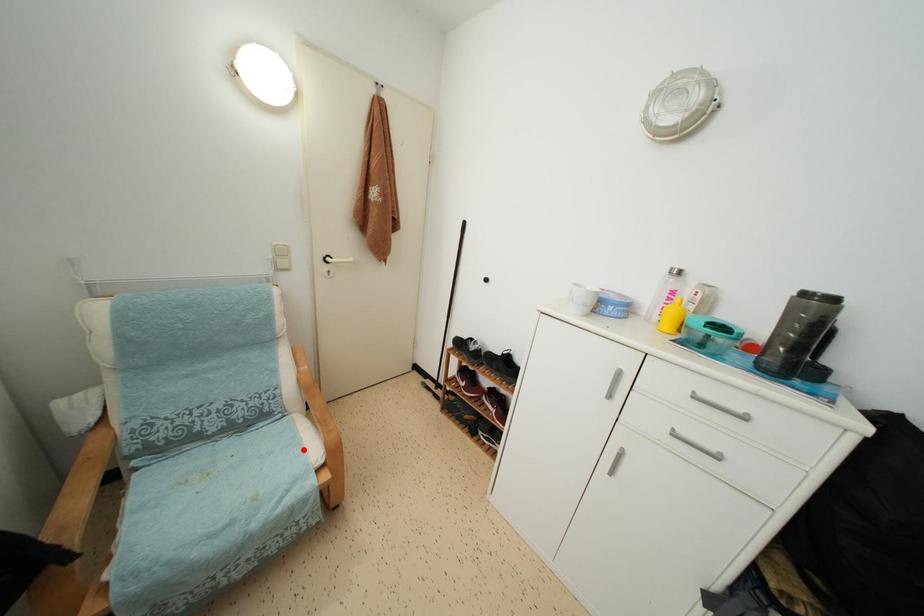
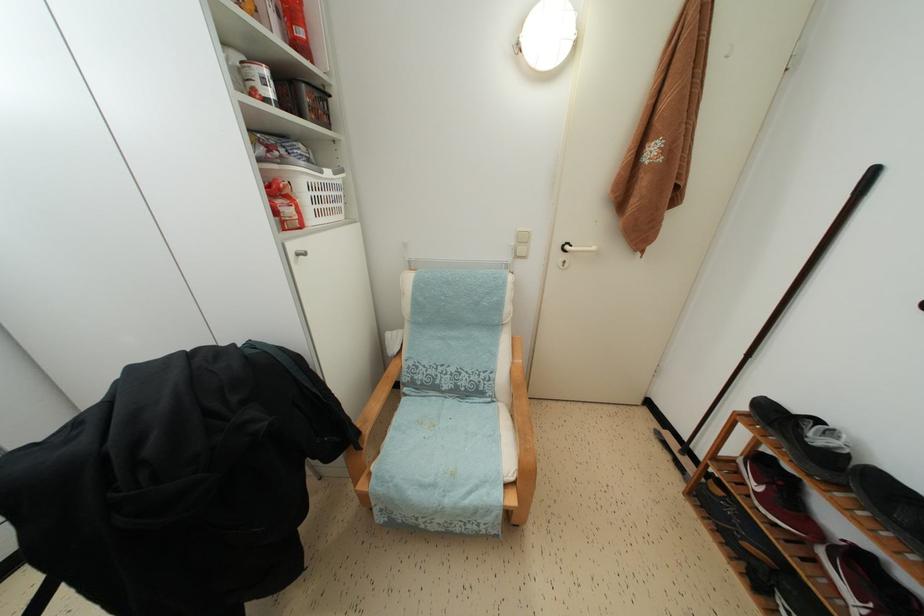
Question: I am providing you with two images of the same scene from different viewpoints. A red point is marked on the first image. At the location where the point appears in image 1, is it still visible in image 2?

Choices:
 (A) Yes
 (B) No

Answer: (A)